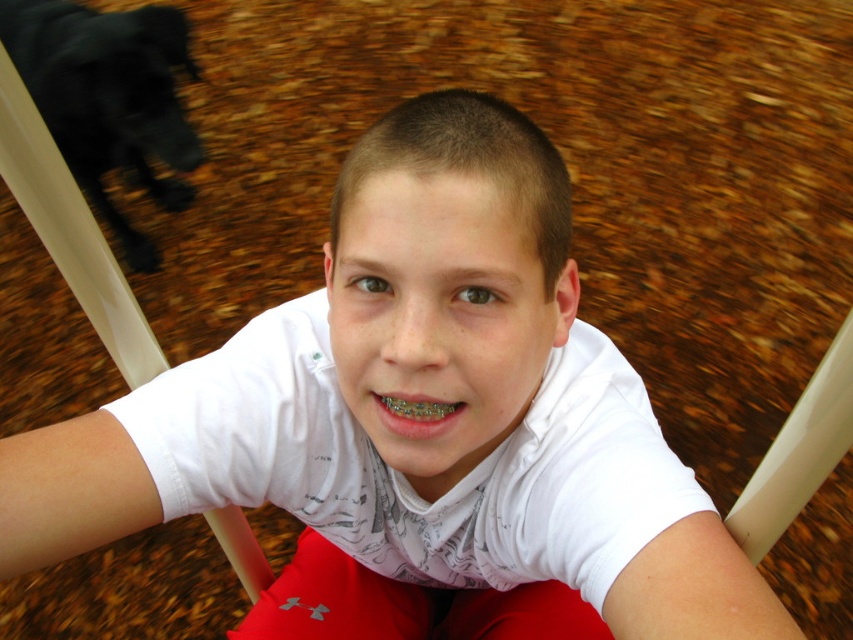
Question: Does white cotton shirt at center appear over black fur dog at upper left?

Choices:
 (A) yes
 (B) no

Answer: (B)

Question: Which point is closer to the camera?

Choices:
 (A) (132, 32)
 (B) (299, 506)
 (C) (440, 412)

Answer: (C)

Question: Among these objects, which one is farthest from the camera?

Choices:
 (A) white cotton shirt at center
 (B) black fur dog at upper left
 (C) metallic silver braces at center

Answer: (B)

Question: Can you confirm if black fur dog at upper left is positioned to the right of metallic silver braces at center?

Choices:
 (A) no
 (B) yes

Answer: (A)

Question: From the image, what is the correct spatial relationship of white cotton shirt at center in relation to metallic silver braces at center?

Choices:
 (A) above
 (B) below

Answer: (B)

Question: Among these points, which one is farthest from the camera?

Choices:
 (A) (154, 12)
 (B) (346, 454)
 (C) (445, 403)

Answer: (A)